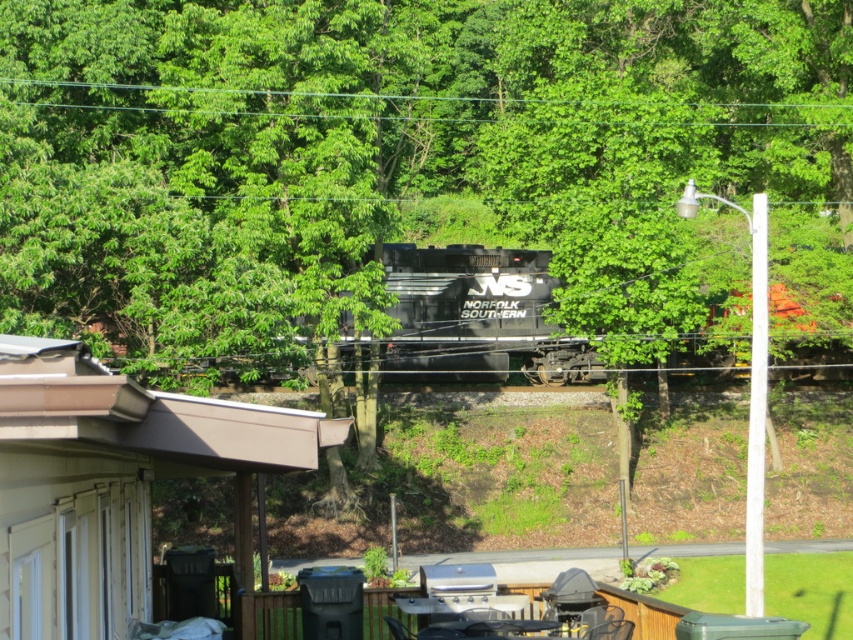
You are standing on the wooden deck and want to move to the brown wood shed at lower left without crossing the tracks. Can you do so by going around the black matte train at center?

The brown wood shed at lower left is positioned on the left side of the black matte train at center, so you can go around the train to reach it without crossing the tracks.

You are standing on the wooden deck and want to take a photo of the black matte train at center without the brown wood shed at lower left blocking the view. Where should you move to ensure the shed doesn

To avoid the brown wood shed at lower left blocking the view of the black matte train at center, you should move to a position behind the shed since the shed is in front of the train.

You are standing at the point marked as point (113,481) on the image. What object are you standing on?

You are standing on the brown wood shed at lower left.